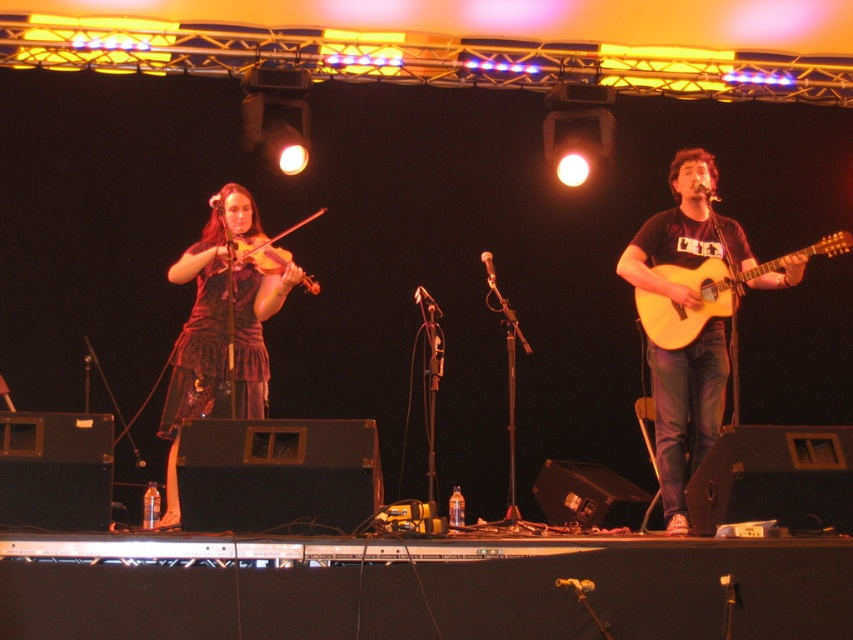
Question: Can you confirm if metallic silver microphone at upper right is wider than metallic silver microphone at upper center?

Choices:
 (A) yes
 (B) no

Answer: (A)

Question: Can you confirm if matte brown guitar at right is positioned below light brown acoustic guitar at right?

Choices:
 (A) yes
 (B) no

Answer: (A)

Question: Does light brown acoustic guitar at right appear under metallic silver microphone at upper center?

Choices:
 (A) yes
 (B) no

Answer: (A)

Question: Among these objects, which one is farthest from the camera?

Choices:
 (A) light brown acoustic guitar at right
 (B) matte brown guitar at right
 (C) shiny purple dress at left
 (D) metallic silver microphone at upper center

Answer: (D)

Question: Which of the following is the farthest from the observer?

Choices:
 (A) tap(254, 352)
 (B) tap(781, 268)
 (C) tap(711, 198)
 (D) tap(207, 198)

Answer: (D)

Question: Which point appears farthest from the camera in this image?

Choices:
 (A) (695, 186)
 (B) (250, 248)
 (C) (677, 349)

Answer: (B)